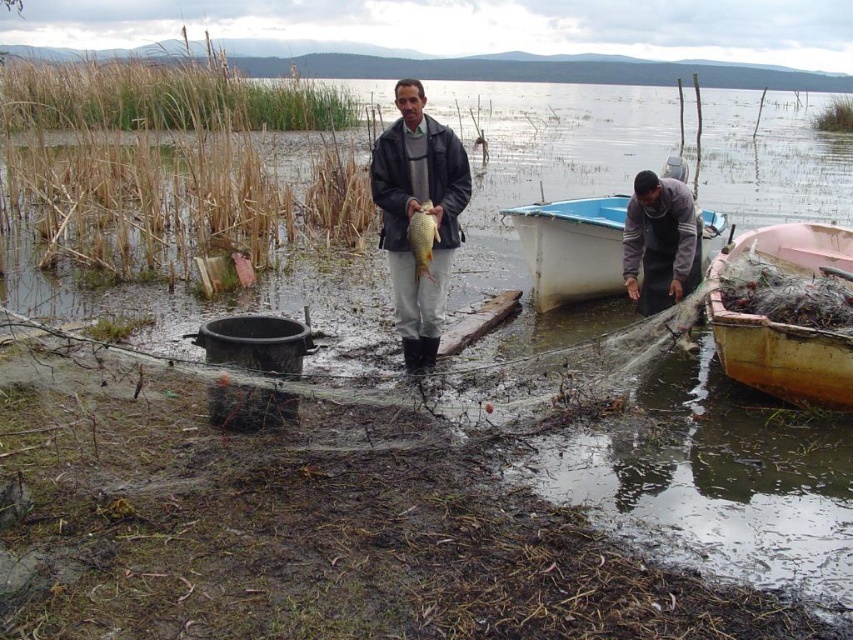
Question: Can you confirm if matte black jacket at center is bigger than shiny golden fish at center?

Choices:
 (A) yes
 (B) no

Answer: (A)

Question: Estimate the real-world distances between objects in this image. Which object is farther from the white plastic boat at lower center?

Choices:
 (A) shiny golden fish at center
 (B) rusty wooden boat at right
 (C) dark gray apron at lower right

Answer: (A)

Question: Is matte black jacket at center in front of rusty wooden boat at right?

Choices:
 (A) yes
 (B) no

Answer: (B)

Question: Considering the relative positions of matte black jacket at center and rusty wooden boat at right in the image provided, where is matte black jacket at center located with respect to rusty wooden boat at right?

Choices:
 (A) below
 (B) above

Answer: (B)

Question: Among these objects, which one is nearest to the camera?

Choices:
 (A) dark gray apron at lower right
 (B) white plastic boat at lower center
 (C) matte black jacket at center
 (D) rusty wooden boat at right

Answer: (D)

Question: Which object is farther from the camera taking this photo?

Choices:
 (A) rusty wooden boat at right
 (B) dark gray apron at lower right
 (C) shiny golden fish at center

Answer: (B)